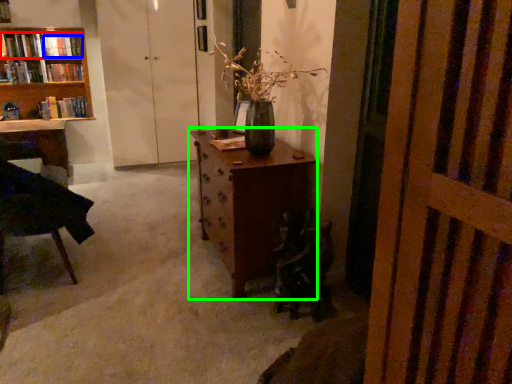
Question: Estimate the real-world distances between objects in this image. Which object is closer to book (highlighted by a red box), book (highlighted by a blue box) or table (highlighted by a green box)?

Choices:
 (A) book
 (B) table

Answer: (A)